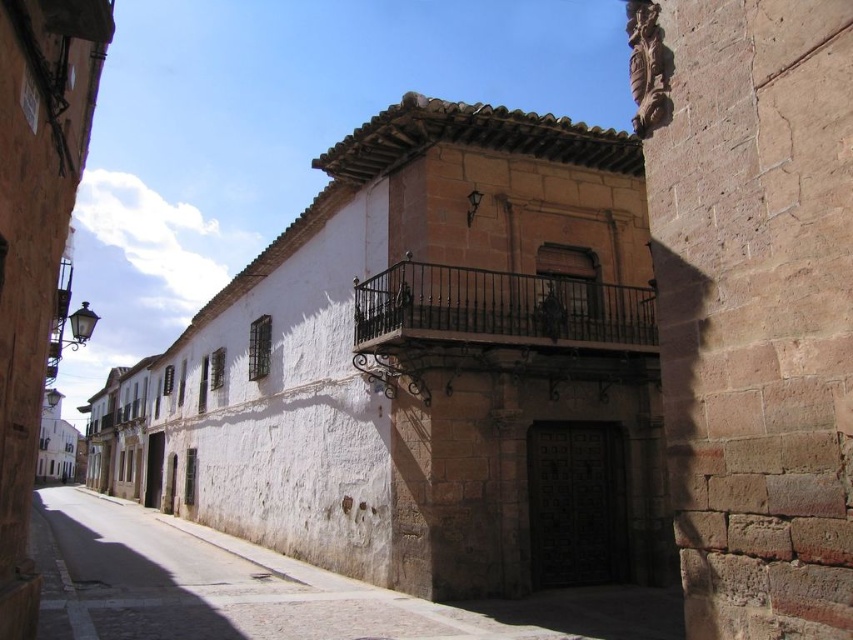
You are an architect planning to install a new decorative element on the street. You have a choice between placing it on the white stone wall at lower center or the black wrought iron balcony at center. Based on their widths, which location would allow for a wider decorative element?

The white stone wall at lower center might be wider than the black wrought iron balcony at center, so the white stone wall at lower center would allow for a wider decorative element.

You are standing on the street in front of the building. You see the white stone wall at lower center and the black wrought iron balcony at center. Which one is positioned to the left side from your perspective?

The white stone wall at lower center is positioned to the left of the black wrought iron balcony at center.

You are standing in front of the historic building and want to take a photo of the white stone wall at lower center. If your camera can focus on objects up to 10 meters away, will you need to move closer or farther away to capture a clear photo?

The white stone wall at lower center is 10.56 meters away from the camera. Since the camera can focus up to 10 meters, you need to move closer to ensure the white stone wall at lower center is within the focus range.